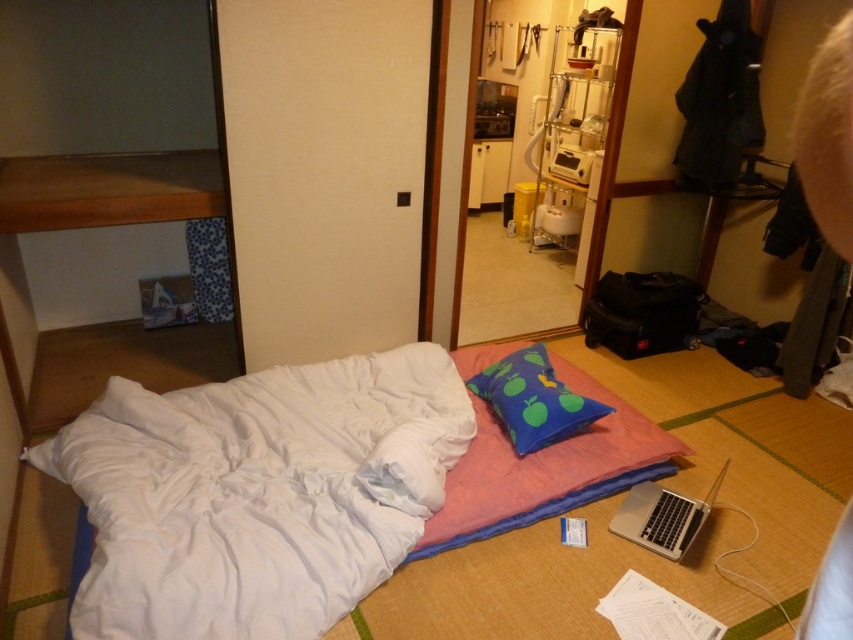
Between white soft bed at center and pink fabric at center, which one is positioned higher?

white soft bed at center is higher up.

Can you confirm if white soft bed at center is smaller than pink fabric at center?

No, white soft bed at center is not smaller than pink fabric at center.

Describe the element at coordinates (212, 502) in the screenshot. I see `white soft bed at center` at that location.

Locate an element on the screen. The image size is (853, 640). white soft bed at center is located at coordinates (212, 502).

Consider the image. Does pink fabric at center have a greater width compared to silver metallic laptop at lower right?

Yes.

Who is more forward, (585, 493) or (689, 509)?

Point (689, 509)

Identify the location of pink fabric at center. The width and height of the screenshot is (853, 640). pos(538,468).

Does point (221, 436) lie behind point (627, 504)?

No.

Does white soft bed at center appear on the right side of silver metallic laptop at lower right?

Incorrect, white soft bed at center is not on the right side of silver metallic laptop at lower right.

Who is more forward, (310, 460) or (648, 518)?

Point (310, 460) is more forward.

The width and height of the screenshot is (853, 640). What are the coordinates of `white soft bed at center` in the screenshot? It's located at (212, 502).